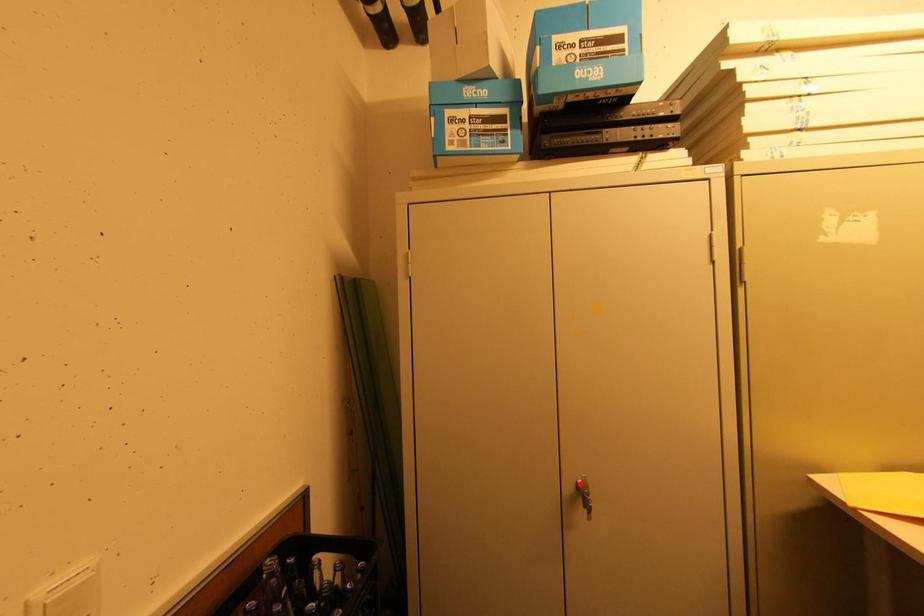
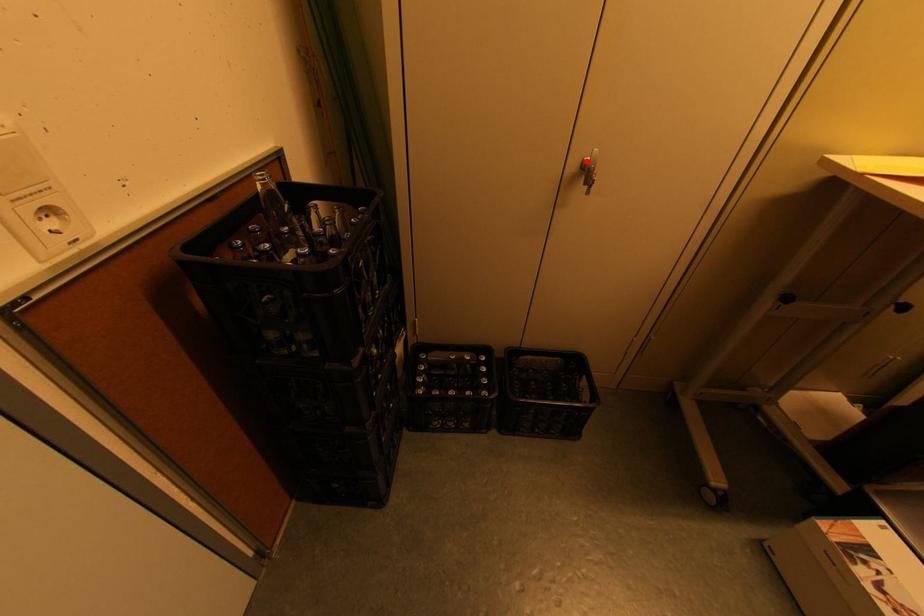
I am providing you with two images of the same scene from different viewpoints. A red point is marked on the first image and another point is marked on the second image. Are the points marked in image1 and image2 representing the same 3D position?

Yes